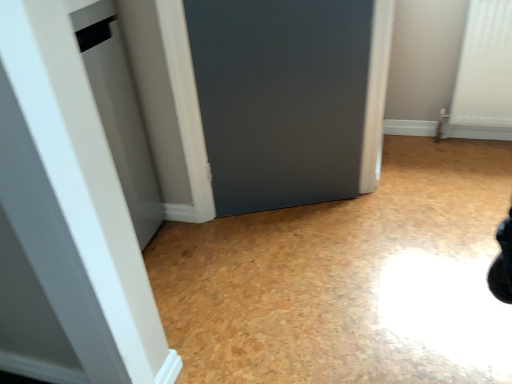
Find the location of a particular element. vacant point to the right of white glossy door at left is located at coordinates (192, 244).